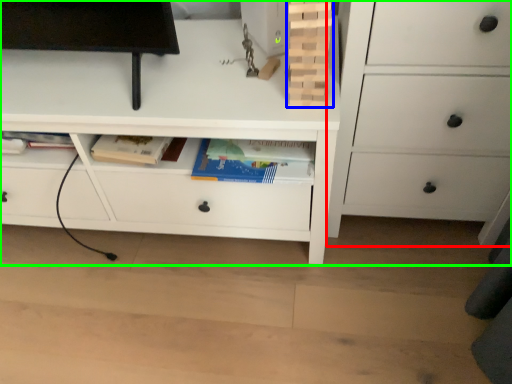
Question: Which object is the farthest from chest of drawers (highlighted by a red box)? Choose among these: book (highlighted by a blue box) or chest of drawers (highlighted by a green box).

Choices:
 (A) book
 (B) chest of drawers

Answer: (A)